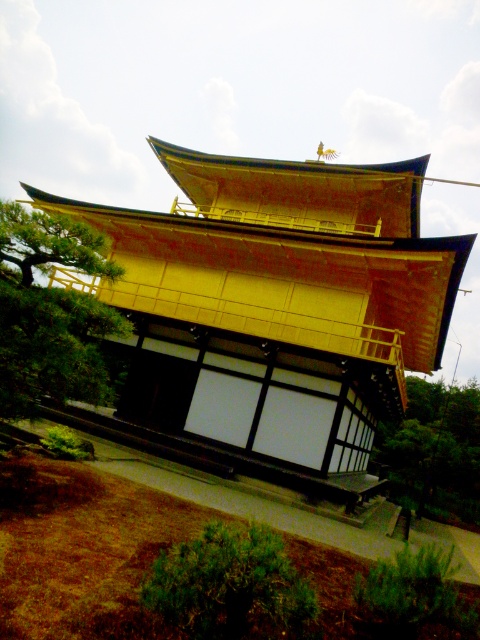
Question: Is gold lacquered wood temple at center further to camera compared to green leafy tree at lower right?

Choices:
 (A) yes
 (B) no

Answer: (B)

Question: Which point appears closest to the camera in this image?

Choices:
 (A) (254, 579)
 (B) (193, 412)

Answer: (A)

Question: Can you confirm if green leafy tree at left is positioned to the right of green leafy bush at lower center?

Choices:
 (A) no
 (B) yes

Answer: (A)

Question: From the image, what is the correct spatial relationship of gold lacquered wood temple at center in relation to green leafy tree at lower right?

Choices:
 (A) right
 (B) left

Answer: (B)

Question: Which object appears farthest from the camera in this image?

Choices:
 (A) gold lacquered wood temple at center
 (B) green leafy tree at lower right
 (C) green leafy tree at left

Answer: (B)

Question: Among these points, which one is farthest from the camera?

Choices:
 (A) (0, 252)
 (B) (410, 465)
 (C) (456, 269)

Answer: (B)